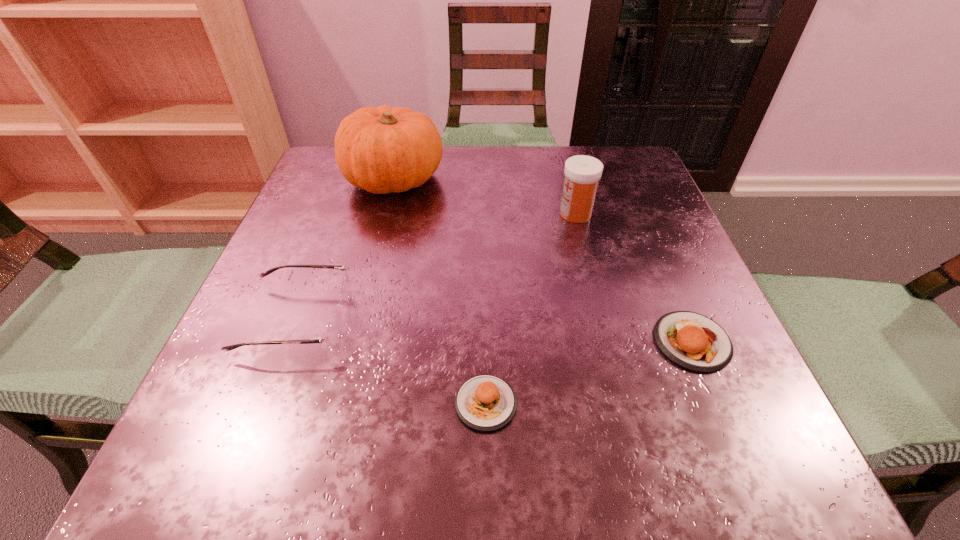
Locate an element on the screen. This screenshot has height=540, width=960. object that is at the far left corner is located at coordinates (381, 150).

The width and height of the screenshot is (960, 540). I want to click on object located at the far right corner, so [582, 173].

This screenshot has width=960, height=540. In the image, there is a desktop. Identify the location of vacant area at the far edge. (542, 157).

Identify the location of vacant space at the near edge of the desktop. (340, 457).

In the image, there is a desktop. At what (x,y) coordinates should I click in order to perform the action: click on vacant space at the left edge. Please return your answer as a coordinate pair (x, y). The width and height of the screenshot is (960, 540). Looking at the image, I should click on (351, 207).

You are a GUI agent. You are given a task and a screenshot of the screen. Output one action in this format:
    pyautogui.click(x=<x>, y=<y>)
    Task: Click on the free space at the right edge
    This screenshot has width=960, height=540.
    Given the screenshot: What is the action you would take?
    pyautogui.click(x=704, y=394)

Where is `vacant region at the near right corner of the desktop`? Image resolution: width=960 pixels, height=540 pixels. vacant region at the near right corner of the desktop is located at coordinates (724, 477).

Where is `vacant space that's between the third object from left to right and the tallest object`? vacant space that's between the third object from left to right and the tallest object is located at coordinates coord(440,291).

At what (x,y) coordinates should I click in order to perform the action: click on vacant region between the tallest object and the taller food. Please return your answer as a coordinate pair (x, y). The height and width of the screenshot is (540, 960). Looking at the image, I should click on (543, 260).

Locate an element on the screen. vacant space in between the fourth tallest object and the third object from right to left is located at coordinates (589, 373).